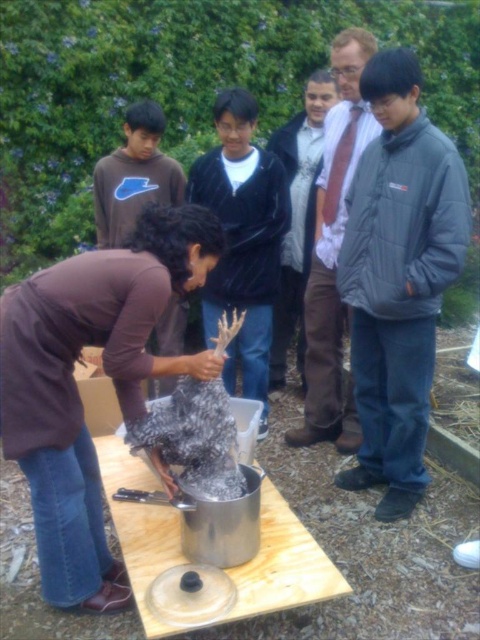
Question: From the image, what is the correct spatial relationship of plywood picnic table at center in relation to light brown leather jacket at center?

Choices:
 (A) right
 (B) left

Answer: (B)

Question: Among these objects, which one is farthest from the camera?

Choices:
 (A) brown soft sweater at center
 (B) brown leather jacket at upper center

Answer: (A)

Question: Is plywood picnic table at center smaller than shiny silver pot at center?

Choices:
 (A) no
 (B) yes

Answer: (A)

Question: Can you confirm if brown leather jacket at upper center is wider than light brown leather jacket at center?

Choices:
 (A) yes
 (B) no

Answer: (A)

Question: Among these points, which one is nearest to the camera?

Choices:
 (A) (300, 321)
 (B) (175, 195)
 (C) (205, 419)
 (D) (338, 234)

Answer: (C)

Question: Among these objects, which one is nearest to the camera?

Choices:
 (A) brown soft sweater at center
 (B) plywood picnic table at center
 (C) light brown leather jacket at center
 (D) shiny silver pot at center

Answer: (B)